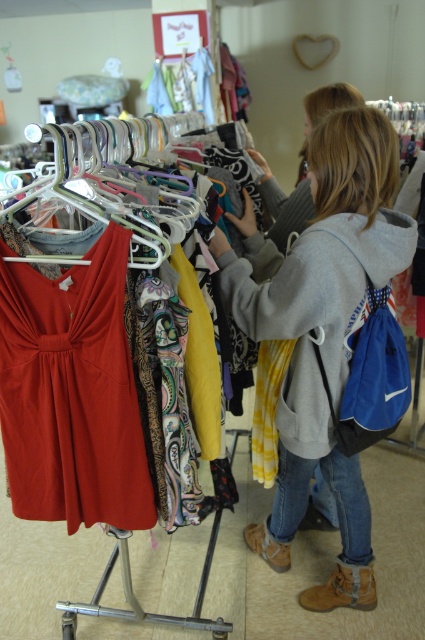
You are a customer in the thrift store looking for a dress. You see the matte red dress at center. Where exactly is it located in the store?

The matte red dress at center is located at point 0.616 on the x axis and 0.169 on the y axis.

You are a store employee who needs to rearrange the clothing rack. The matte red dress at center is taking up too much space compared to the metallic silver hanger at upper left. Which item should you consider removing to free up more space?

The matte red dress at center occupies less space than the metallic silver hanger at upper left, so removing the metallic silver hanger at upper left would free up more space.